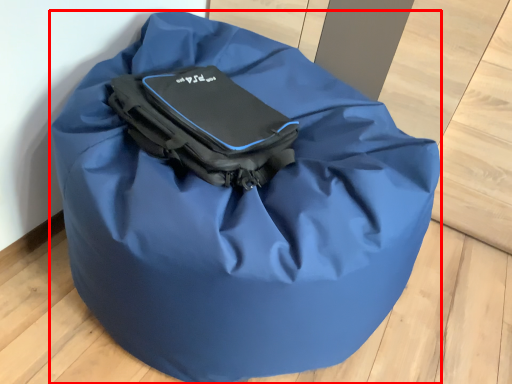
Question: From the image's perspective, where is luggage and bags (annotated by the red box) located in relation to pack in the image?

Choices:
 (A) below
 (B) above

Answer: (A)